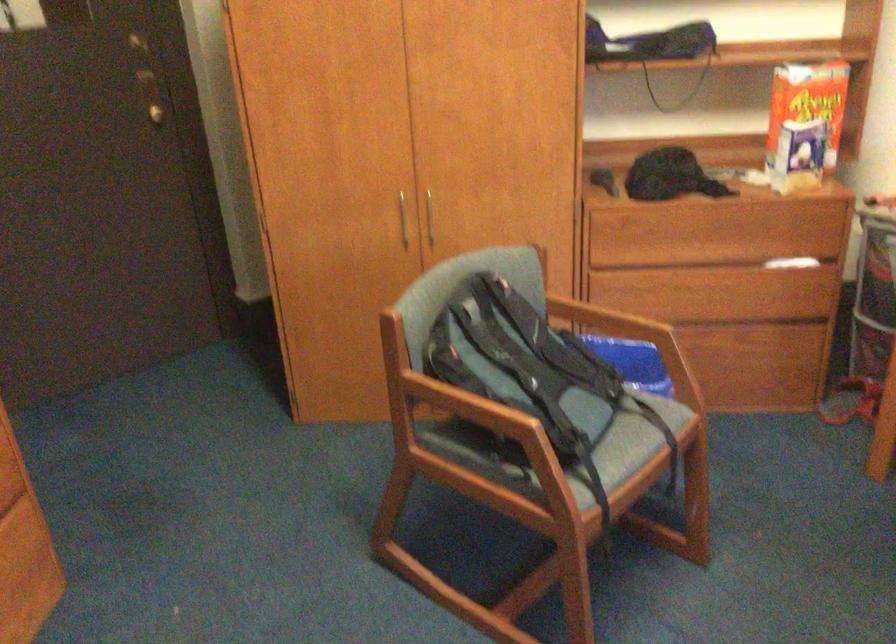
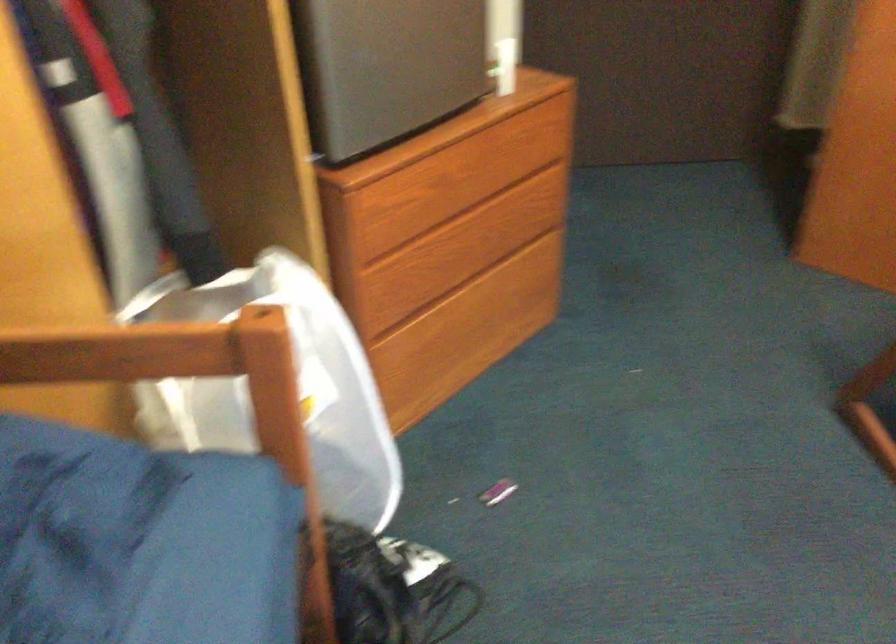
How did the camera likely rotate?

The rotation direction of the camera is left-down.